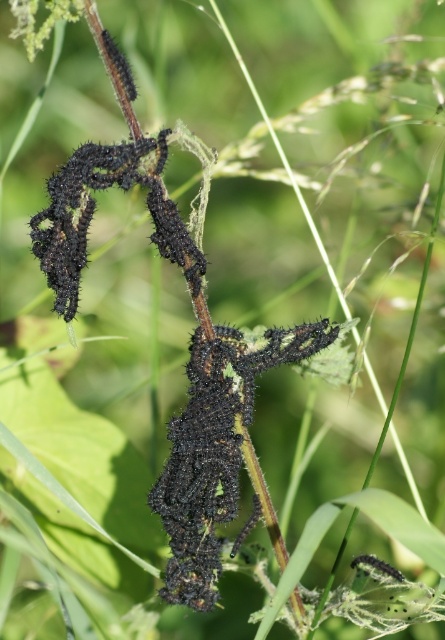
You are a biologist measuring distances in a natural habitat. You are standing at a point and see a cluster of caterpillars on a stem at point (203,259). You need to place a protective cover that extends 1 meter from your current position. Will the caterpillars be within the coverage area?

The distance between your position and the caterpillars at point (203,259) is 92.45 centimeters. Since the protective cover extends 1 meter, the caterpillars will be within the coverage area as 92.45 cm is less than 100 cm.

You are a photographer taking a closeup photo of the caterpillars on the stem. You want to focus on the point closer to the camera. Which point should you choose between point (241, 416) and point (157, 141)?

Point (241, 416) is further to the camera than point (157, 141), so you should choose point (241, 416) to focus on the point closer to the camera.